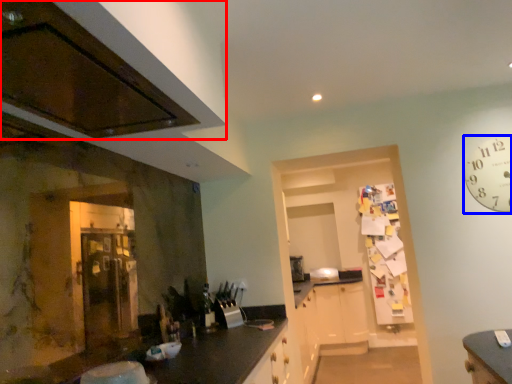
Question: Which point is further to the camera, cabinetry (highlighted by a red box) or clock (highlighted by a blue box)?

Choices:
 (A) cabinetry
 (B) clock

Answer: (B)